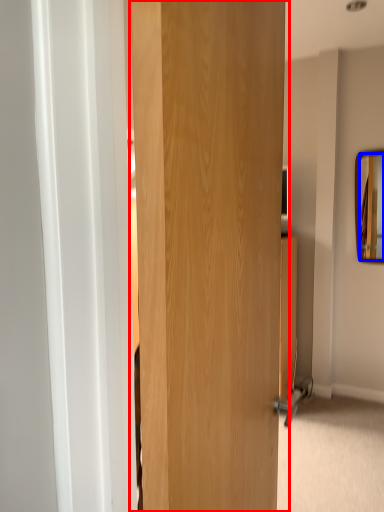
Question: Which object appears farthest to the camera in this image, door (highlighted by a red box) or mirror (highlighted by a blue box)?

Choices:
 (A) door
 (B) mirror

Answer: (B)